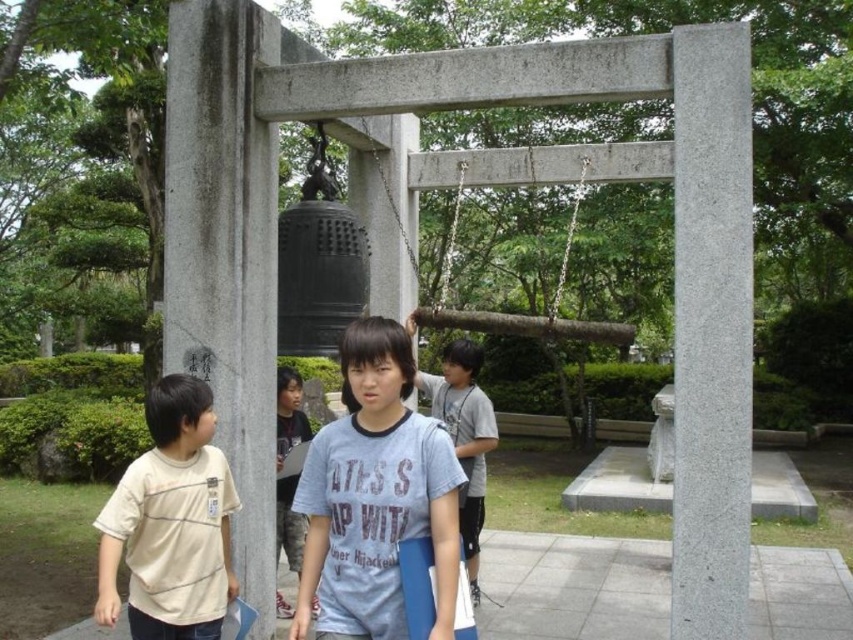
Does gray stone pillar at left have a lesser width compared to beige cotton t-shirt at left?

No.

Is gray stone pillar at left wider than beige cotton t-shirt at left?

Indeed, gray stone pillar at left has a greater width compared to beige cotton t-shirt at left.

Image resolution: width=853 pixels, height=640 pixels. Describe the element at coordinates (225, 252) in the screenshot. I see `gray stone pillar at left` at that location.

This screenshot has width=853, height=640. What are the coordinates of `gray stone pillar at left` in the screenshot? It's located at (225, 252).

Who is higher up, blue cotton shirt at center or beige cotton t-shirt at left?

blue cotton shirt at center is above.

Between point (379, 362) and point (207, 552), which one is positioned in front?

Point (379, 362) is more forward.

Locate an element on the screen. This screenshot has width=853, height=640. blue cotton shirt at center is located at coordinates (375, 497).

Measure the distance between gray stone pillar at left and gray granite pillar at center.

They are 7.61 feet apart.

At what (x,y) coordinates should I click in order to perform the action: click on gray stone pillar at left. Please return your answer as a coordinate pair (x, y). Image resolution: width=853 pixels, height=640 pixels. Looking at the image, I should click on (225, 252).

This screenshot has height=640, width=853. Identify the location of gray stone pillar at left. (225, 252).